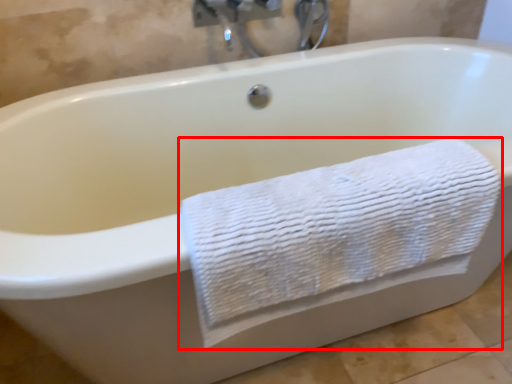
Question: From the image's perspective, where is towel (annotated by the red box) located in relation to faucet in the image?

Choices:
 (A) above
 (B) below

Answer: (B)